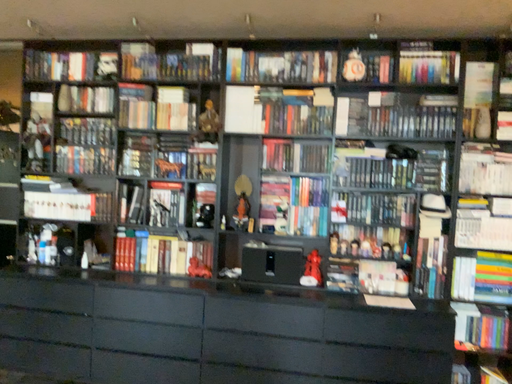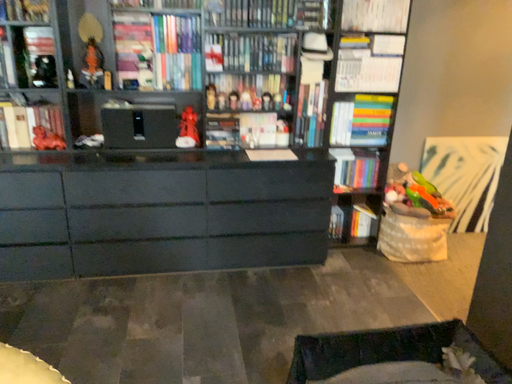
Question: How did the camera likely rotate when shooting the video?

Choices:
 (A) rotated downward
 (B) rotated upward

Answer: (A)